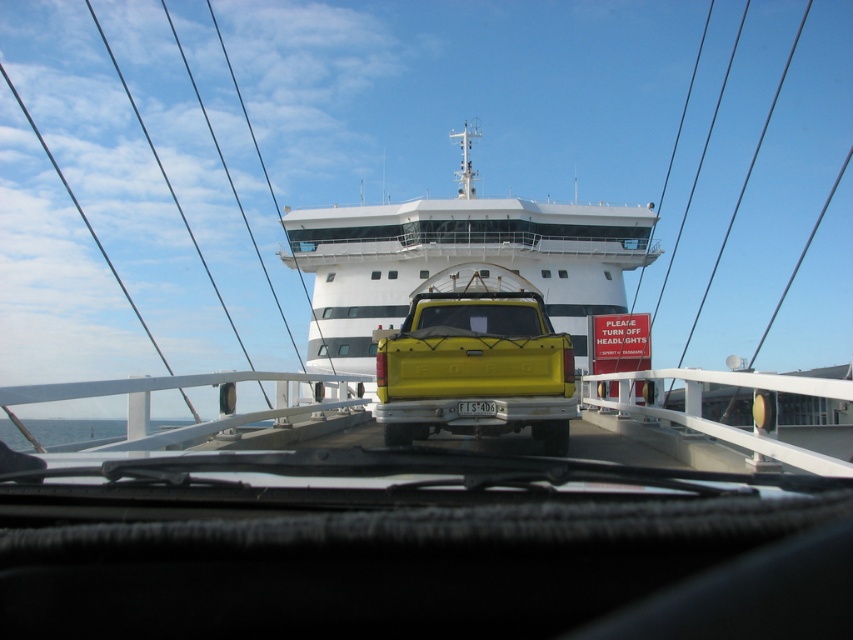
Which is behind, point (537, 316) or point (463, 406)?

Point (537, 316)

Image resolution: width=853 pixels, height=640 pixels. Identify the location of yellow matte truck at center. (474, 362).

Does point (508, 348) come closer to viewer compared to point (465, 403)?

No.

Find the location of `yellow matte truck at center`. yellow matte truck at center is located at coordinates (474, 362).

Who is positioned more to the left, white glossy cruise ship at upper center or yellow matte truck at center?

yellow matte truck at center

Consider the image. Is white glossy cruise ship at upper center thinner than yellow matte truck at center?

In fact, white glossy cruise ship at upper center might be wider than yellow matte truck at center.

The height and width of the screenshot is (640, 853). In order to click on white glossy cruise ship at upper center in this screenshot , I will do `click(457, 259)`.

Which of these two, white glossy cruise ship at upper center or white plastic license plate at center, stands shorter?

With less height is white plastic license plate at center.

Is white glossy cruise ship at upper center shorter than white plastic license plate at center?

No.

You are a GUI agent. You are given a task and a screenshot of the screen. Output one action in this format:
    pyautogui.click(x=<x>, y=<y>)
    Task: Click on the white glossy cruise ship at upper center
    The width and height of the screenshot is (853, 640).
    Given the screenshot: What is the action you would take?
    pyautogui.click(x=457, y=259)

Where is `white glossy cruise ship at upper center`? The width and height of the screenshot is (853, 640). white glossy cruise ship at upper center is located at coordinates (457, 259).